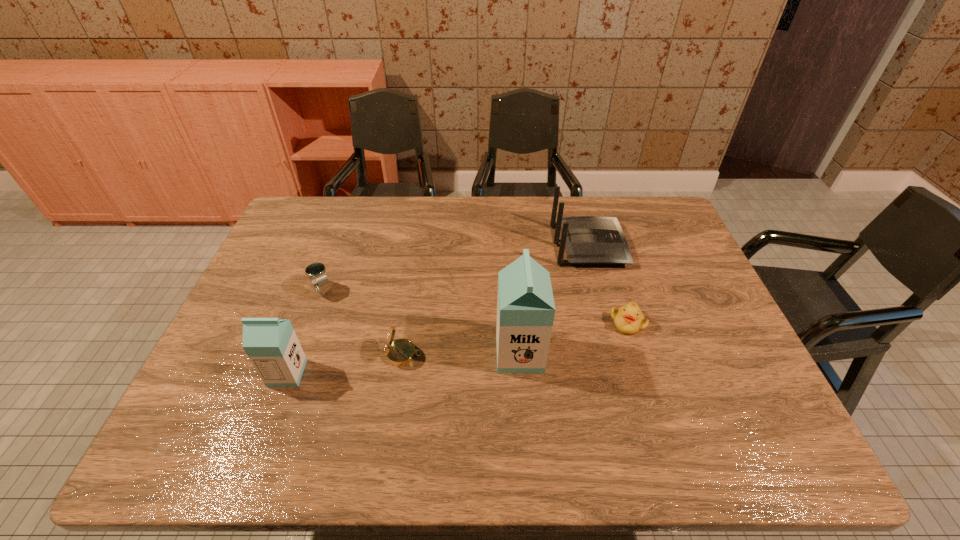
Locate an element on the screen. The width and height of the screenshot is (960, 540). empty space between the second tallest object and the fourth shortest object is located at coordinates (438, 309).

The image size is (960, 540). Find the location of `free space that is in between the shorter milk carton and the third object from left to right`. free space that is in between the shorter milk carton and the third object from left to right is located at coordinates (345, 363).

At what (x,y) coordinates should I click in order to perform the action: click on the second closest object relative to the shorter milk carton. Please return your answer as a coordinate pair (x, y). The width and height of the screenshot is (960, 540). Looking at the image, I should click on (316, 271).

Locate an element on the screen. The height and width of the screenshot is (540, 960). object that is the fifth closest to the farthest object is located at coordinates (272, 346).

You are a GUI agent. You are given a task and a screenshot of the screen. Output one action in this format:
    pyautogui.click(x=<x>, y=<y>)
    Task: Click on the free location that satisfies the following two spatial constraints: 1. on the back side of the third object from right to left; 2. on the right side of the left milk carton
    
    Given the screenshot: What is the action you would take?
    pyautogui.click(x=294, y=354)